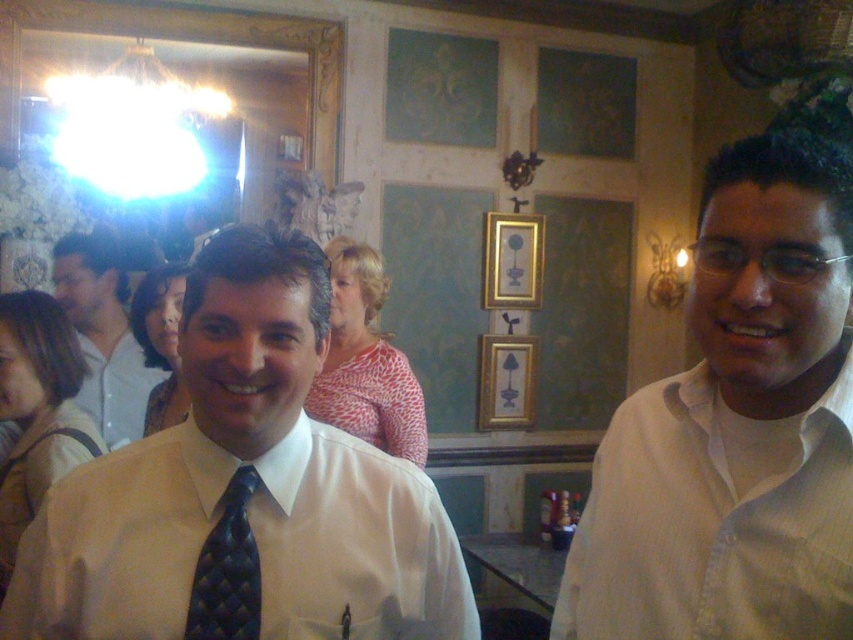
How far apart are black woven tie at center and gold/gilded picture frame at upper center?

The distance of black woven tie at center from gold/gilded picture frame at upper center is 11.44 feet.

Between point (256, 579) and point (489, 269), which one is positioned behind?

Point (489, 269)

Identify the location of black woven tie at center. Image resolution: width=853 pixels, height=640 pixels. (227, 570).

At what (x,y) coordinates should I click in order to perform the action: click on black woven tie at center. Please return your answer as a coordinate pair (x, y). The width and height of the screenshot is (853, 640). Looking at the image, I should click on (227, 570).

Who is more forward, (831,291) or (108,323)?

Point (831,291) is more forward.

Is point (776, 528) behind point (117, 291)?

No, it is not.

Which is behind, point (785, 227) or point (102, 374)?

The point (102, 374) is behind.

Where is `white shirt at right`? This screenshot has width=853, height=640. white shirt at right is located at coordinates (735, 428).

Based on the photo, measure the distance between matte white shirt at center and camera.

matte white shirt at center and camera are 10.27 feet apart from each other.

I want to click on matte white shirt at center, so 103,333.